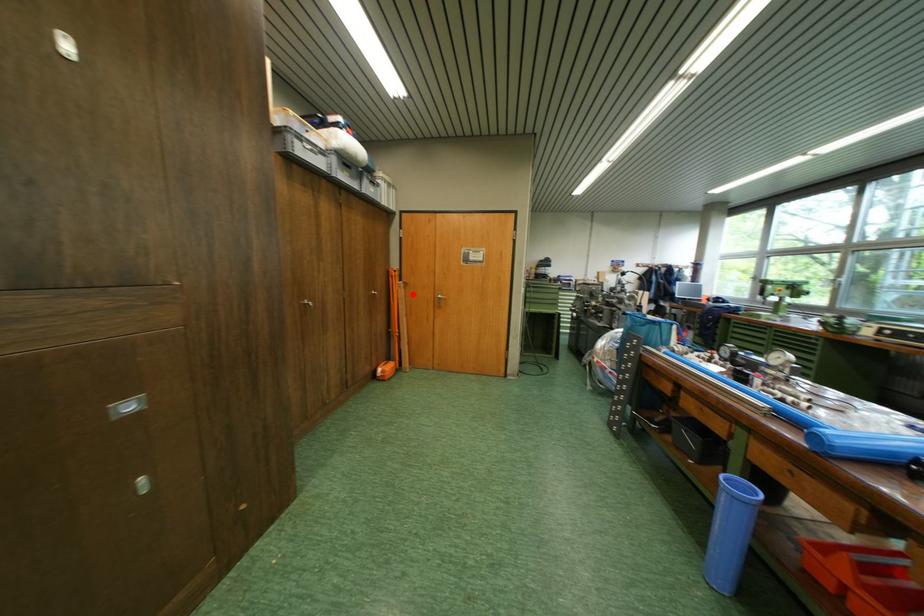
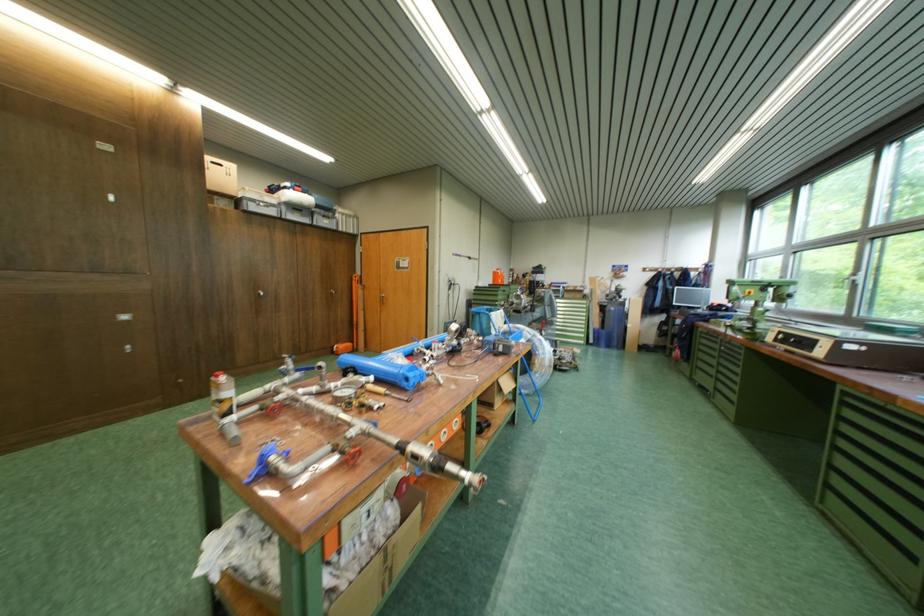
Find the pixel in the second image that matches the highlighted location in the first image.

(371, 294)